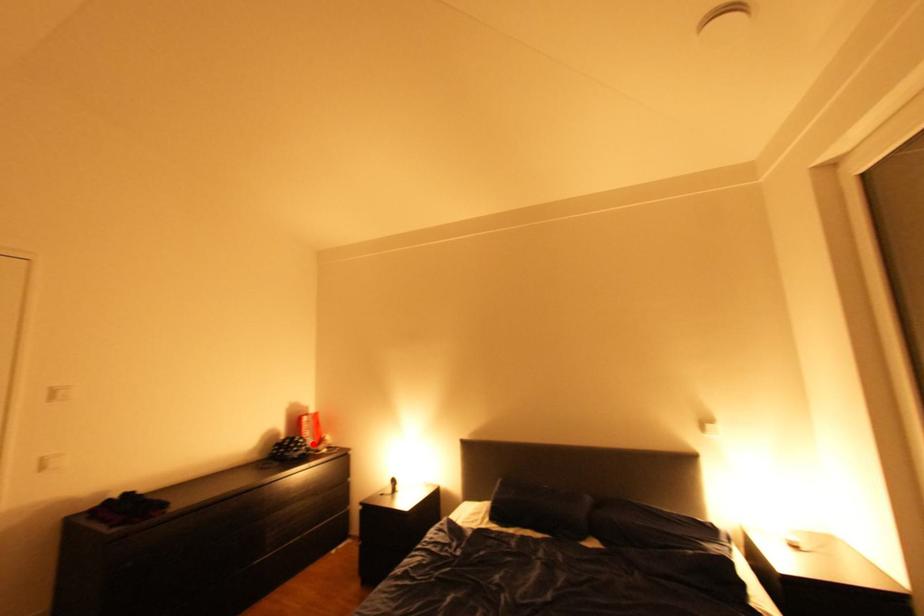
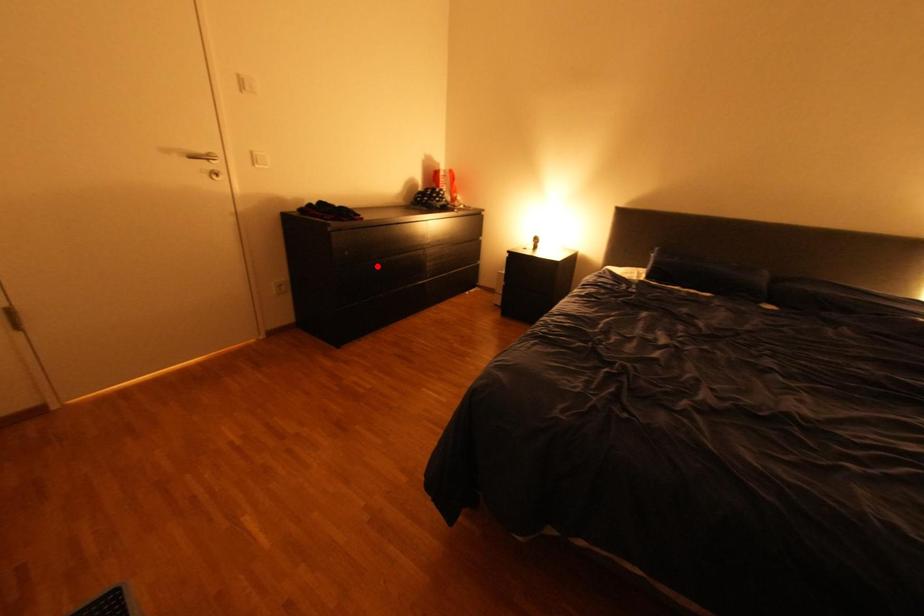
In the scene shown: I am providing you with two images of the same scene from different viewpoints. A red point is marked on the first image and another point is marked on the second image. Is the marked point in image1 the same physical position as the marked point in image2?

No